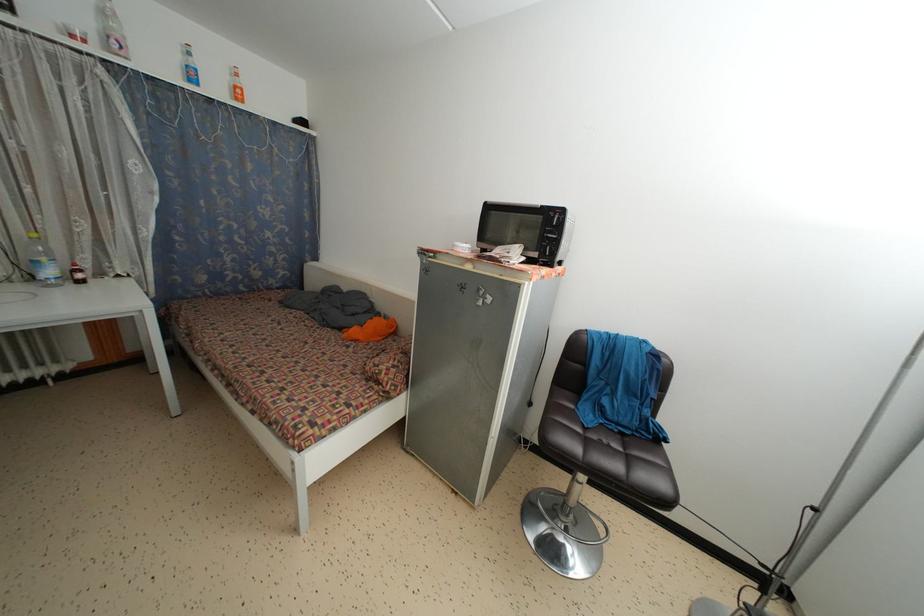
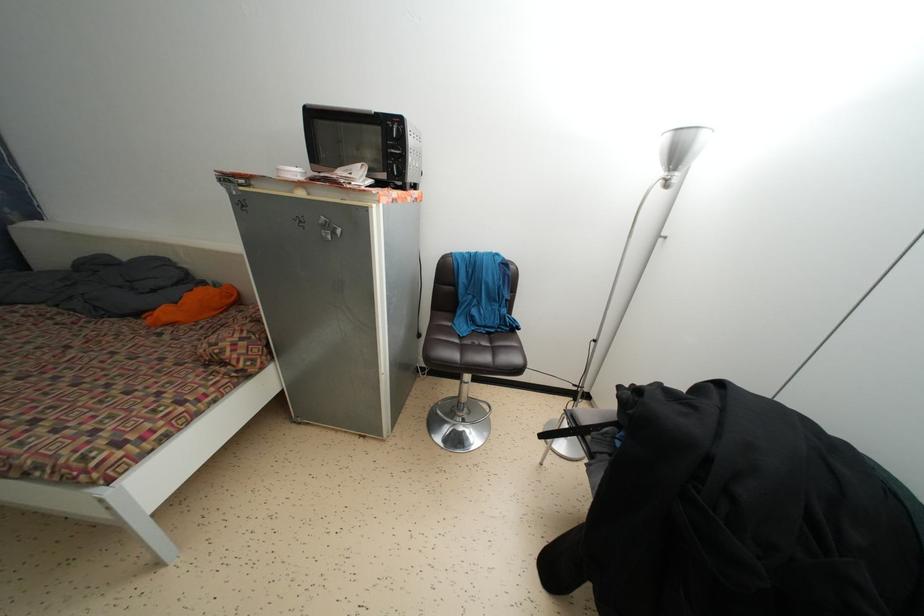
Where in the second image is the point corresponding to (x=626, y=440) from the first image?

(492, 339)